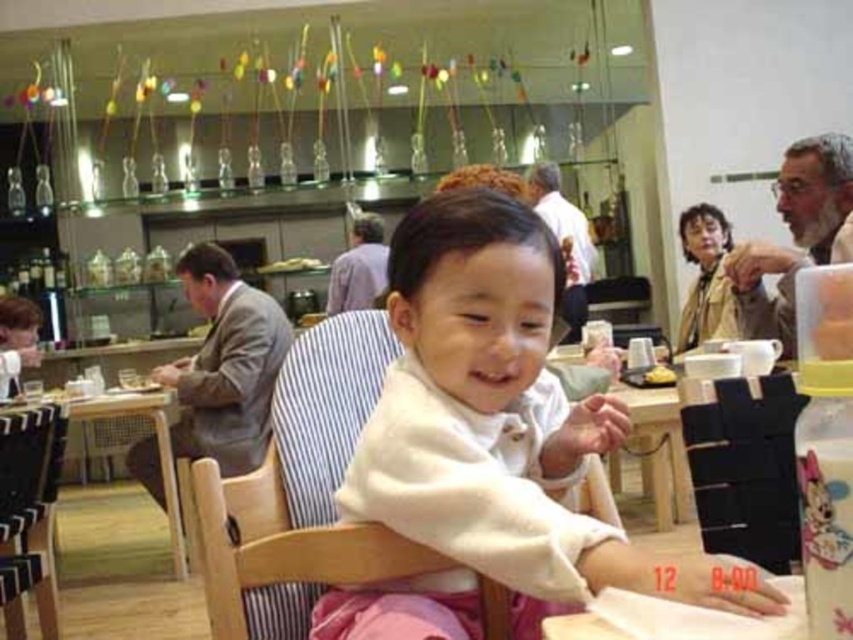
Question: Does white soft baby at center appear under wooden highchair at center?

Choices:
 (A) no
 (B) yes

Answer: (A)

Question: Considering the real-world distances, which object is closest to the gray hair at upper right?

Choices:
 (A) white shirt at upper center
 (B) wooden highchair at center
 (C) wooden chair at center

Answer: (B)

Question: Based on their relative distances, which object is nearer to the green fabric table at lower left?

Choices:
 (A) light brown suit at left
 (B) white soft baby at center
 (C) wooden chair at center
 (D) matte beige sweater at upper right

Answer: (A)

Question: Is wooden highchair at center bigger than white shirt at upper center?

Choices:
 (A) yes
 (B) no

Answer: (B)

Question: Considering the relative positions of green fabric table at lower left and striped shirt at center in the image provided, where is green fabric table at lower left located with respect to striped shirt at center?

Choices:
 (A) right
 (B) left

Answer: (B)

Question: Which object is positioned farthest from the wooden chair at center?

Choices:
 (A) striped shirt at center
 (B) wooden highchair at center

Answer: (A)